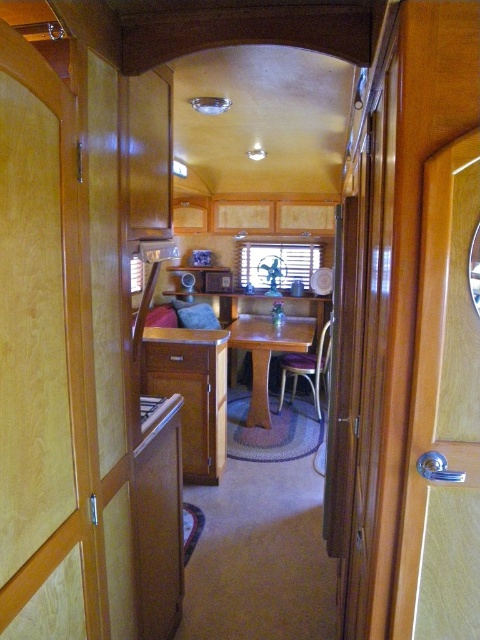
You are organizing a small dinner party inside this vintage trailer. You have a large platter that needs a surface to place it on. Which object between the wooden table at center and the wooden drawer at center would be more suitable for placing the platter?

The wooden table at center is larger in size than the wooden drawer at center, so the wooden table at center would be more suitable for placing the large platter.

What are the coordinates of the wooden table at center in the image?

The wooden table at center is located at coordinates point (x=265, y=353).

You are planning to place a 3.5 feet wide dining table between the metallic purple chair at center and the wooden drawer at center. Will the table fit in the space between them?

The metallic purple chair at center and wooden drawer at center are 5.25 feet apart. Since the table is 3.5 feet wide, it will fit as there is enough space between them.